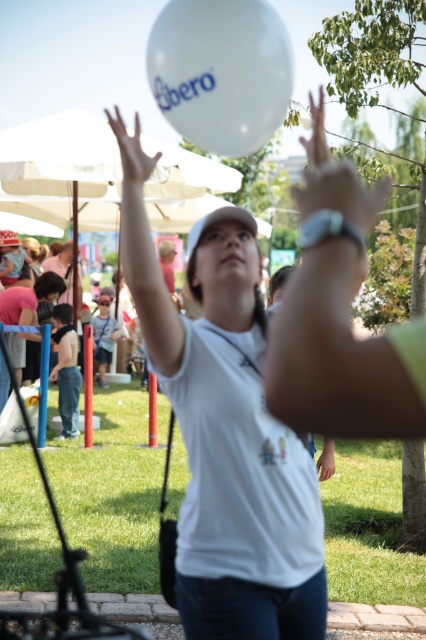
You are a photographer at the event and want to capture a photo of the person with the white balloon. You are currently standing at point 0.5, 0.05. Which direction should you move to frame the matte pink shirt at lower left in the photo?

The matte pink shirt at lower left is located at point [28,300]. Since you are at [21,320], you should move slightly to the left and upwards to align the matte pink shirt at lower left in the frame.

You are a photographer trying to capture the white matte balloon at center. Based on the coordinates provided, where should you aim your camera to ensure the balloon is centered in your shot?

You should aim your camera at the coordinates point (229, 442) to center the white matte balloon at center in your shot.

You are a photographer trying to capture a clear shot of both the white matte balloon at center and the white matte balloon at upper center. Based on their positions, which balloon should you focus on first to ensure both are in the frame?

The white matte balloon at upper center should be focused on first because the white matte balloon at center is to the right of it, allowing you to adjust the frame to include both.